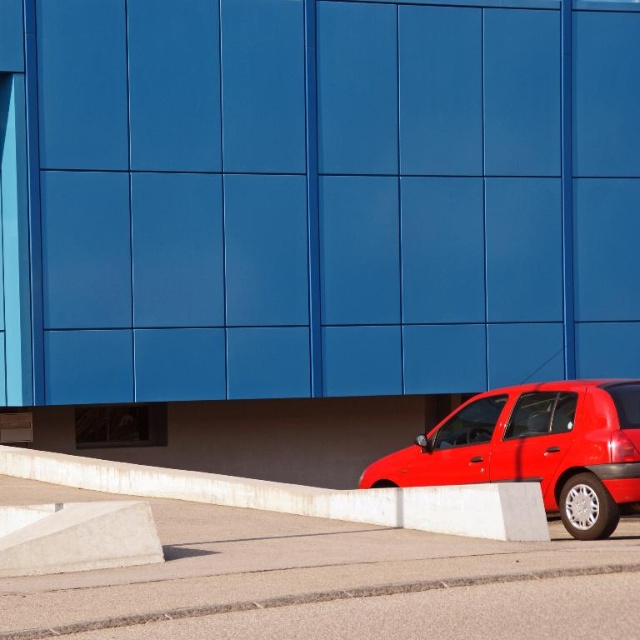
Does glossy red car at lower right appear on the right side of white concrete curb at lower right?

Indeed, glossy red car at lower right is positioned on the right side of white concrete curb at lower right.

Describe the element at coordinates (536, 449) in the screenshot. Image resolution: width=640 pixels, height=640 pixels. I see `glossy red car at lower right` at that location.

Is point (609, 403) positioned in front of point (188, 499)?

Yes, it is in front of point (188, 499).

Find the location of `glossy red car at lower right`. glossy red car at lower right is located at coordinates (536, 449).